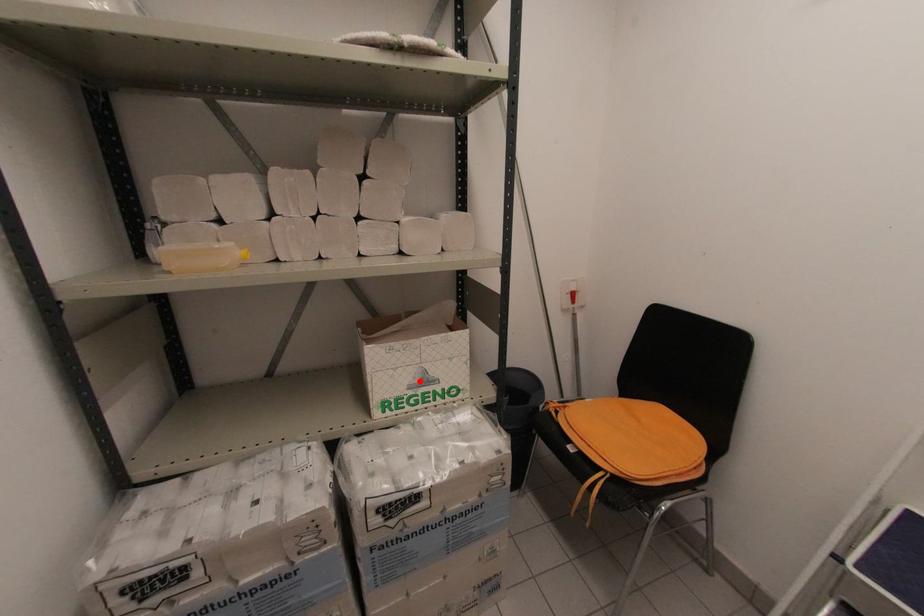
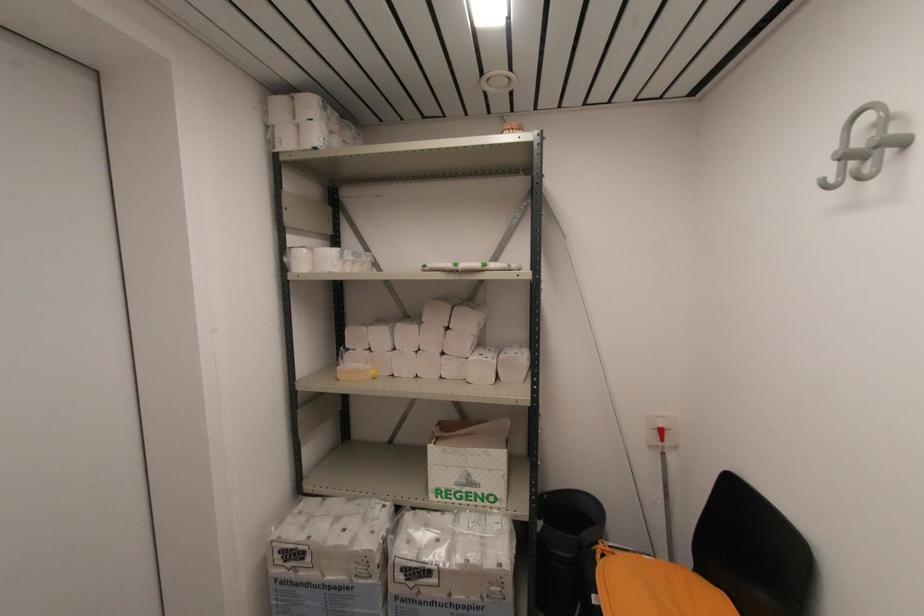
Locate, in the second image, the point that corresponds to the highlighted location in the first image.

(465, 480)